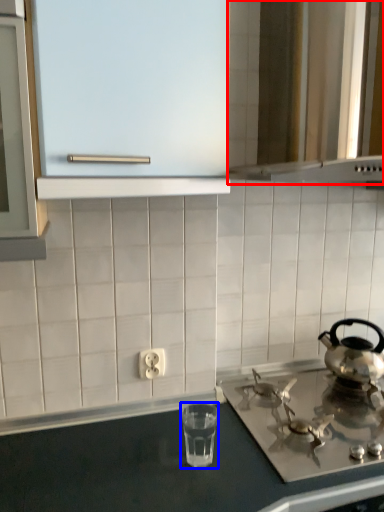
Question: Which object appears farthest to the camera in this image, vent (highlighted by a red box) or appliance (highlighted by a blue box)?

Choices:
 (A) vent
 (B) appliance

Answer: (B)